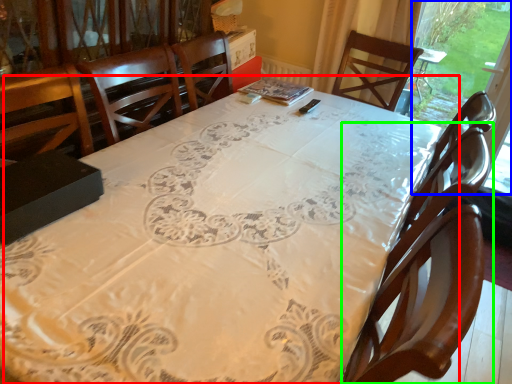
Question: Which object is the closest to the table (highlighted by a red box)? Choose among these: window screen (highlighted by a blue box) or chair (highlighted by a green box).

Choices:
 (A) window screen
 (B) chair

Answer: (B)